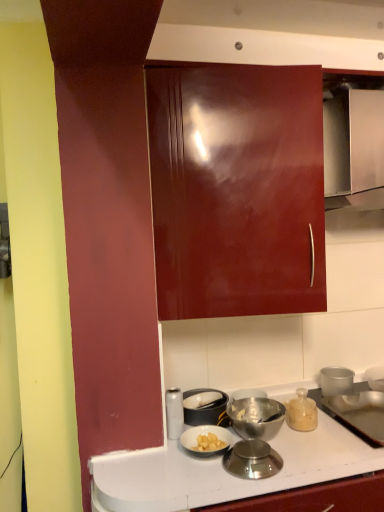
The height and width of the screenshot is (512, 384). What do you see at coordinates (252, 460) in the screenshot?
I see `metallic silver scale at lower center, the second kitchen appliance positioned from the left` at bounding box center [252, 460].

Where is `white glossy canister at lower center, the 1th kitchen appliance from the left`? Image resolution: width=384 pixels, height=512 pixels. white glossy canister at lower center, the 1th kitchen appliance from the left is located at coordinates (174, 413).

This screenshot has height=512, width=384. Describe the element at coordinates (174, 413) in the screenshot. I see `white glossy canister at lower center, the 1th kitchen appliance from the left` at that location.

From the picture: Measure the distance between point (325, 74) and camera.

The distance of point (325, 74) from camera is 4.80 feet.

Find the location of a particular element. The image size is (384, 512). matte glass jar at lower right, placed as the third kitchen appliance when sorted from front to back is located at coordinates point(302,412).

This screenshot has width=384, height=512. What do you see at coordinates (302, 412) in the screenshot? I see `matte glass jar at lower right, the 1th kitchen appliance when ordered from right to left` at bounding box center [302, 412].

The height and width of the screenshot is (512, 384). Identify the location of metallic silver scale at lower center, the second kitchen appliance positioned from the left. (252, 460).

From a real-world perspective, relative to metallic silver scale at lower center, the second kitchen appliance positioned from the left, is white glossy canister at lower center, the second kitchen appliance positioned from the front, vertically above or below?

white glossy canister at lower center, the second kitchen appliance positioned from the front, is above metallic silver scale at lower center, the second kitchen appliance positioned from the left.

From the image's perspective, relative to metallic silver scale at lower center, placed as the second kitchen appliance when sorted from right to left, is white glossy canister at lower center, the 1th kitchen appliance from the left, above or below?

From the image's perspective, white glossy canister at lower center, the 1th kitchen appliance from the left, appears above metallic silver scale at lower center, placed as the second kitchen appliance when sorted from right to left.

Considering the points (172, 400) and (231, 452), which point is behind, point (172, 400) or point (231, 452)?

The point (172, 400) is farther from the camera.

Is there a large distance between metallic silver drawer at upper right and white glossy canister at lower center, the second kitchen appliance positioned from the front?

Yes.

Identify the location of kitchen appliance that is the 2nd one when counting downward from the metallic silver drawer at upper right (from the image's perspective). This screenshot has height=512, width=384. (174, 413).

Consider the image. Considering the sizes of objects metallic silver drawer at upper right and white glossy canister at lower center, the 3th kitchen appliance in the right-to-left sequence, in the image provided, who is shorter, metallic silver drawer at upper right or white glossy canister at lower center, the 3th kitchen appliance in the right-to-left sequence,?

white glossy canister at lower center, the 3th kitchen appliance in the right-to-left sequence.

Would you say matte glass jar at lower right, the 1th kitchen appliance when ordered from right to left, is outside metallic silver drawer at upper right?

That's correct, matte glass jar at lower right, the 1th kitchen appliance when ordered from right to left, is outside of metallic silver drawer at upper right.

Considering the points (291, 402) and (362, 195), which point is behind, point (291, 402) or point (362, 195)?

The point (362, 195) is farther.

Which object is further away from the camera taking this photo, matte glass jar at lower right, placed as the 1th kitchen appliance when sorted from back to front, or metallic silver drawer at upper right?

matte glass jar at lower right, placed as the 1th kitchen appliance when sorted from back to front, is further away from the camera.

Considering the sizes of objects matte glass jar at lower right, placed as the third kitchen appliance when sorted from front to back, and metallic silver drawer at upper right in the image provided, who is bigger, matte glass jar at lower right, placed as the third kitchen appliance when sorted from front to back, or metallic silver drawer at upper right?

Bigger between the two is metallic silver drawer at upper right.

Who is bigger, metallic silver drawer at upper right or metallic silver scale at lower center, the 1th kitchen appliance positioned from the front?

metallic silver drawer at upper right is bigger.

Relative to metallic silver scale at lower center, the 1th kitchen appliance positioned from the front, is metallic silver drawer at upper right in front or behind?

In the image, metallic silver drawer at upper right appears behind metallic silver scale at lower center, the 1th kitchen appliance positioned from the front.

Is metallic silver drawer at upper right positioned far away from metallic silver scale at lower center, the second kitchen appliance positioned from the left?

Yes, metallic silver drawer at upper right and metallic silver scale at lower center, the second kitchen appliance positioned from the left, are quite far apart.

From a real-world perspective, is metallic silver scale at lower center, placed as the second kitchen appliance when sorted from right to left, physically below metallic silver drawer at upper right?

Indeed, from a real-world perspective, metallic silver scale at lower center, placed as the second kitchen appliance when sorted from right to left, is positioned beneath metallic silver drawer at upper right.

Is metallic silver scale at lower center, the 1th kitchen appliance positioned from the front, outside of metallic silver drawer at upper right?

That's correct, metallic silver scale at lower center, the 1th kitchen appliance positioned from the front, is outside of metallic silver drawer at upper right.

Would you say metallic silver scale at lower center, which is the 3th kitchen appliance from back to front, is to the left or to the right of metallic silver drawer at upper right in the picture?

In the image, metallic silver scale at lower center, which is the 3th kitchen appliance from back to front, appears on the left side of metallic silver drawer at upper right.

Relative to matte glass jar at lower right, placed as the 1th kitchen appliance when sorted from back to front, is white glossy canister at lower center, the 3th kitchen appliance in the right-to-left sequence, in front or behind?

In the image, white glossy canister at lower center, the 3th kitchen appliance in the right-to-left sequence, appears in front of matte glass jar at lower right, placed as the 1th kitchen appliance when sorted from back to front.

Looking at this image, is white glossy canister at lower center, which is the 2th kitchen appliance in back-to-front order, situated inside matte glass jar at lower right, placed as the 1th kitchen appliance when sorted from back to front, or outside?

white glossy canister at lower center, which is the 2th kitchen appliance in back-to-front order, is outside matte glass jar at lower right, placed as the 1th kitchen appliance when sorted from back to front.

Is point (172, 432) closer or farther from the camera than point (307, 429)?

Clearly, point (172, 432) is more distant from the camera than point (307, 429).

Based on the photo, considering the relative sizes of matte glass jar at lower right, which ranks as the 3th kitchen appliance in left-to-right order, and metallic silver scale at lower center, the second kitchen appliance positioned from the left, in the image provided, is matte glass jar at lower right, which ranks as the 3th kitchen appliance in left-to-right order, bigger than metallic silver scale at lower center, the second kitchen appliance positioned from the left,?

Correct, matte glass jar at lower right, which ranks as the 3th kitchen appliance in left-to-right order, is larger in size than metallic silver scale at lower center, the second kitchen appliance positioned from the left.

In terms of height, does matte glass jar at lower right, the 1th kitchen appliance when ordered from right to left, look taller or shorter compared to metallic silver scale at lower center, placed as the second kitchen appliance when sorted from right to left?

Considering their sizes, matte glass jar at lower right, the 1th kitchen appliance when ordered from right to left, has more height than metallic silver scale at lower center, placed as the second kitchen appliance when sorted from right to left.

In the scene shown: Would you say matte glass jar at lower right, which ranks as the 3th kitchen appliance in left-to-right order, is outside metallic silver scale at lower center, the second kitchen appliance positioned from the left?

Yes.

There is a metallic silver scale at lower center, the second kitchen appliance positioned from the left. Where is `the 2nd kitchen appliance above it (from a real-world perspective)`? the 2nd kitchen appliance above it (from a real-world perspective) is located at coordinates (174, 413).

In order to click on the 1st kitchen appliance below the metallic silver drawer at upper right (from a real-world perspective) in this screenshot , I will do `click(174, 413)`.

When comparing their distances from metallic silver drawer at upper right, does matte glass jar at lower right, placed as the third kitchen appliance when sorted from front to back, or metallic silver scale at lower center, placed as the second kitchen appliance when sorted from right to left, seem further?

metallic silver scale at lower center, placed as the second kitchen appliance when sorted from right to left, lies further to metallic silver drawer at upper right than the other object.

Based on their spatial positions, is metallic silver scale at lower center, placed as the second kitchen appliance when sorted from right to left, or metallic silver drawer at upper right further from matte glass jar at lower right, the 1th kitchen appliance when ordered from right to left?

metallic silver drawer at upper right.

Looking at this image, based on their spatial positions, is metallic silver drawer at upper right or metallic silver scale at lower center, the second kitchen appliance positioned from the left, closer to white glossy canister at lower center, the 3th kitchen appliance in the right-to-left sequence?

metallic silver scale at lower center, the second kitchen appliance positioned from the left, is closer to white glossy canister at lower center, the 3th kitchen appliance in the right-to-left sequence.

When comparing their distances from metallic silver drawer at upper right, does metallic silver scale at lower center, which is the 3th kitchen appliance from back to front, or matte glass jar at lower right, which ranks as the 3th kitchen appliance in left-to-right order, seem further?

The object further to metallic silver drawer at upper right is metallic silver scale at lower center, which is the 3th kitchen appliance from back to front.

Estimate the real-world distances between objects in this image. Which object is further from metallic silver scale at lower center, placed as the second kitchen appliance when sorted from right to left, matte glass jar at lower right, placed as the 1th kitchen appliance when sorted from back to front, or white glossy canister at lower center, which is the 2th kitchen appliance in back-to-front order?

white glossy canister at lower center, which is the 2th kitchen appliance in back-to-front order, is positioned further to the anchor metallic silver scale at lower center, placed as the second kitchen appliance when sorted from right to left.

Considering their positions, is matte glass jar at lower right, placed as the 1th kitchen appliance when sorted from back to front, positioned closer to metallic silver scale at lower center, which is the 3th kitchen appliance from back to front, than metallic silver drawer at upper right?

matte glass jar at lower right, placed as the 1th kitchen appliance when sorted from back to front, is closer to metallic silver scale at lower center, which is the 3th kitchen appliance from back to front.

When comparing their distances from metallic silver scale at lower center, which is the 3th kitchen appliance from back to front, does white glossy canister at lower center, the 1th kitchen appliance from the left, or metallic silver drawer at upper right seem closer?

Among the two, white glossy canister at lower center, the 1th kitchen appliance from the left, is located nearer to metallic silver scale at lower center, which is the 3th kitchen appliance from back to front.

From the image, which object appears to be farther from matte glass jar at lower right, the 1th kitchen appliance when ordered from right to left, metallic silver scale at lower center, the second kitchen appliance positioned from the left, or white glossy canister at lower center, which is the 2th kitchen appliance in back-to-front order?

white glossy canister at lower center, which is the 2th kitchen appliance in back-to-front order.

At what (x,y) coordinates should I click in order to perform the action: click on kitchen appliance between white glossy canister at lower center, the 3th kitchen appliance in the right-to-left sequence, and matte glass jar at lower right, placed as the 1th kitchen appliance when sorted from back to front, in the horizontal direction. Please return your answer as a coordinate pair (x, y). Looking at the image, I should click on (252, 460).

The image size is (384, 512). Identify the location of kitchen appliance between metallic silver drawer at upper right and white glossy canister at lower center, the second kitchen appliance positioned from the front, from top to bottom. (302, 412).